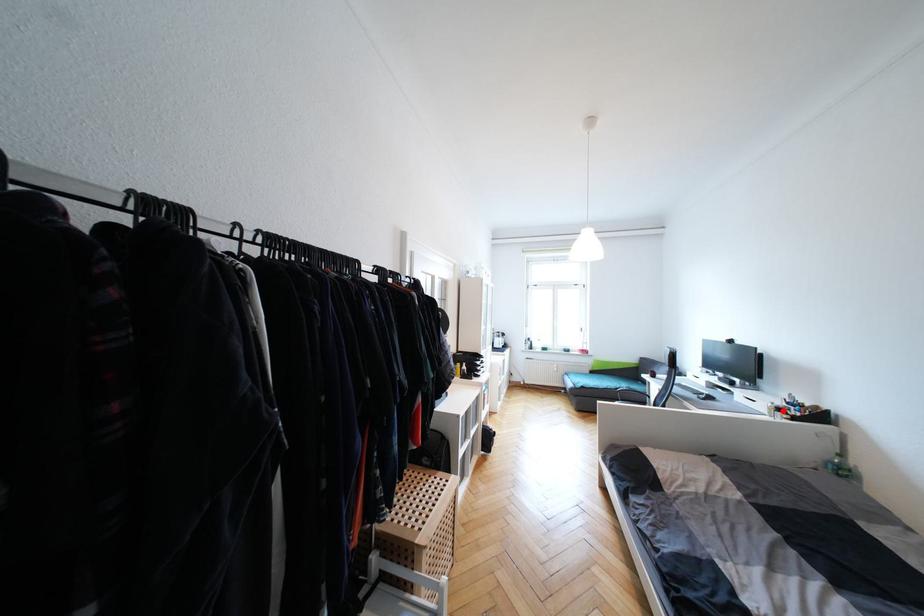
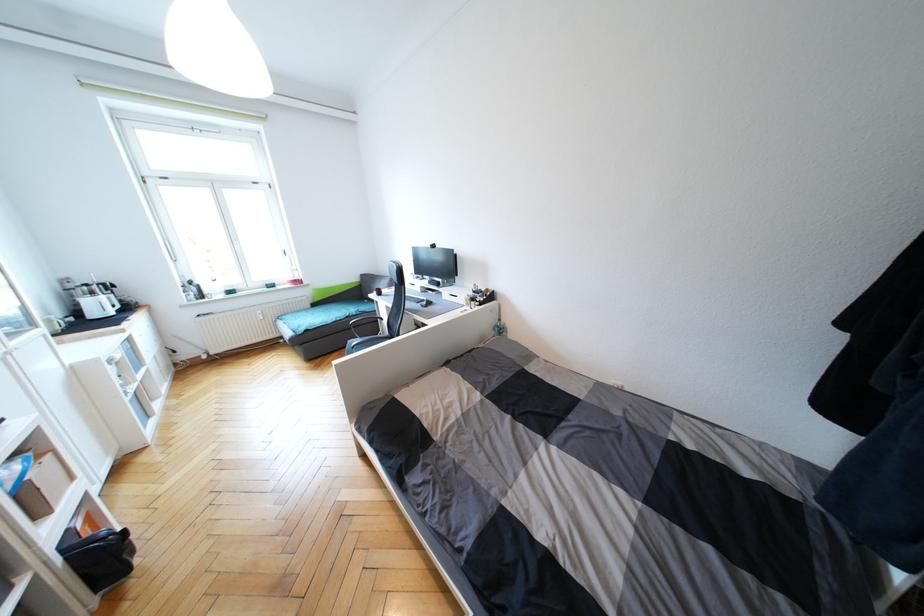
Locate, in the second image, the point that corresponds to the highlighted location in the first image.

(476, 301)